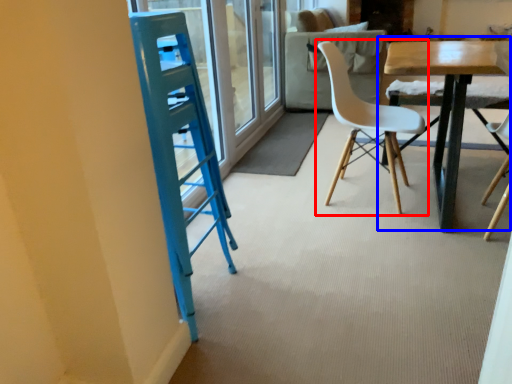
Question: Which object is further to the camera taking this photo, chair (highlighted by a red box) or table (highlighted by a blue box)?

Choices:
 (A) chair
 (B) table

Answer: (A)